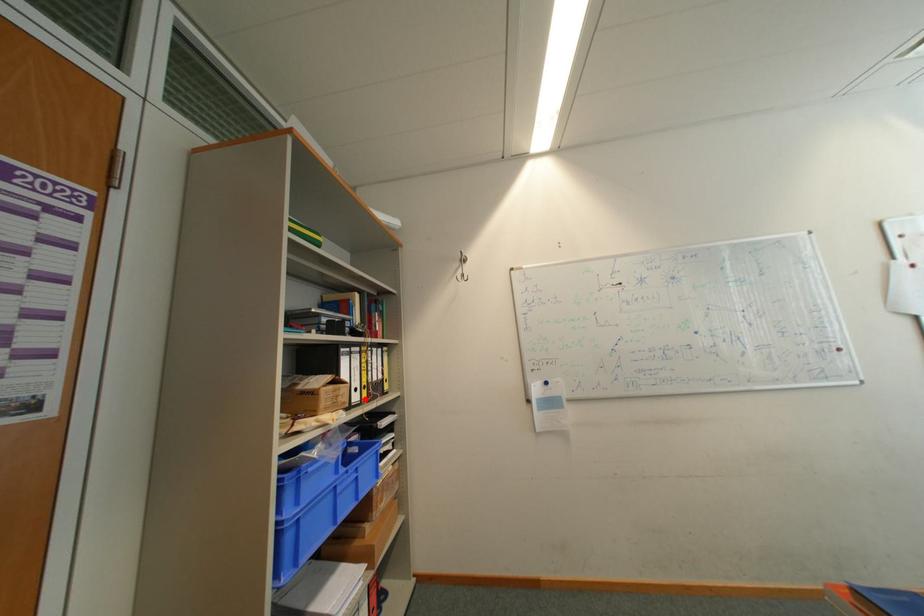
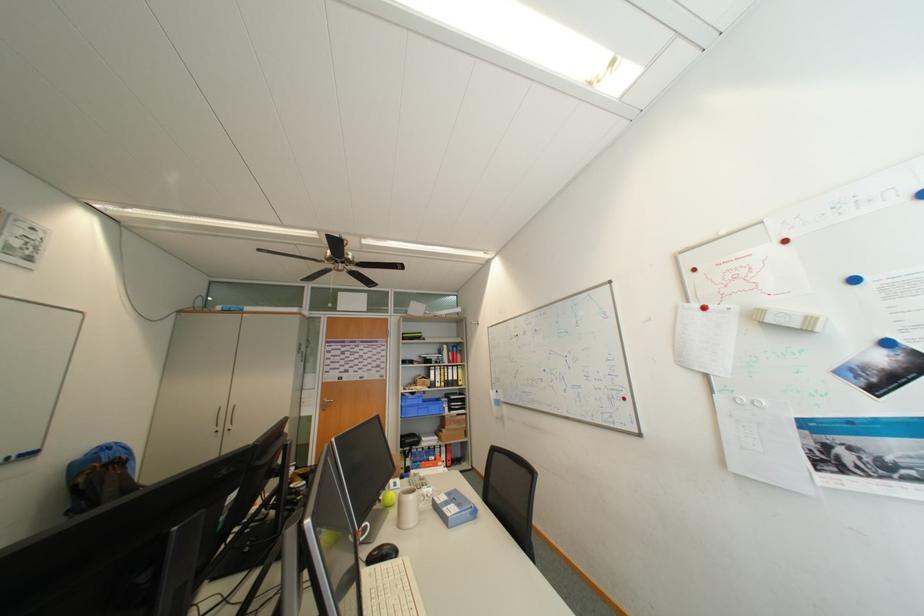
The point at the highlighted location is marked in the first image. Where is the corresponding point in the second image?

(447, 386)